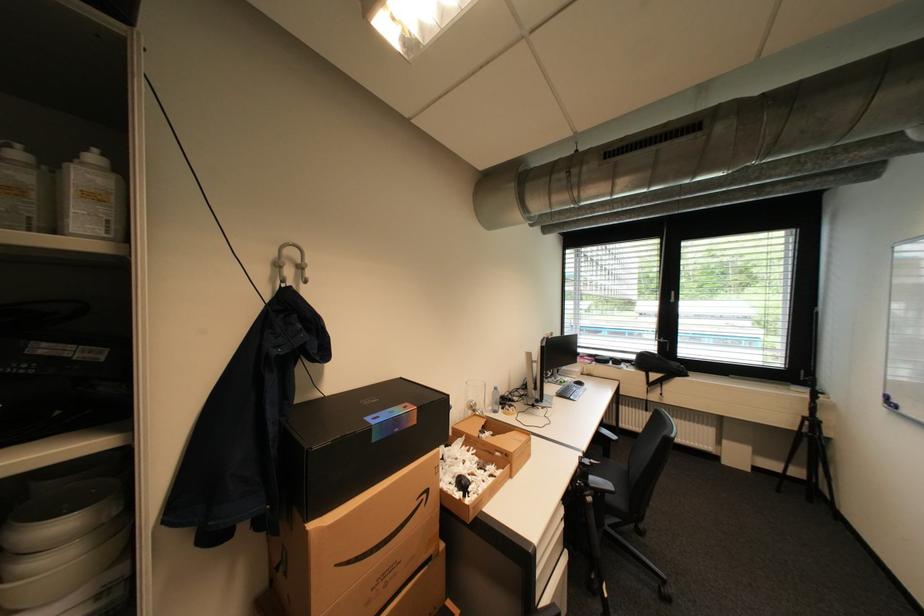
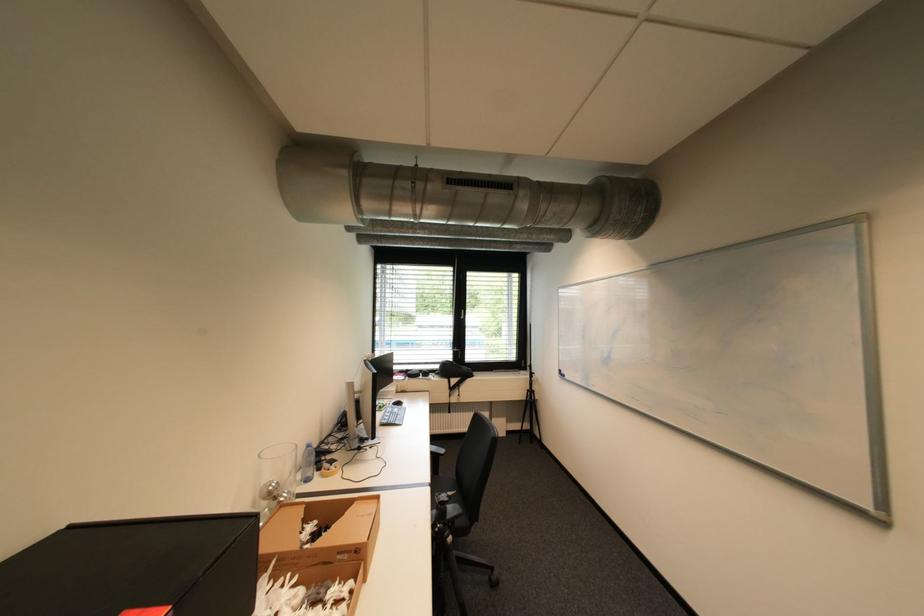
Where in the second image is the point corresponding to (804,430) from the first image?

(532, 400)